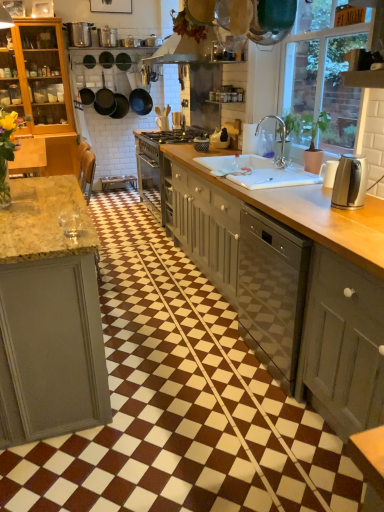
You are a GUI agent. You are given a task and a screenshot of the screen. Output one action in this format:
    pyautogui.click(x=<x>, y=<y>)
    Task: Click on the space that is in front of wooden at center
    
    Given the screenshot: What is the action you would take?
    (192, 351)